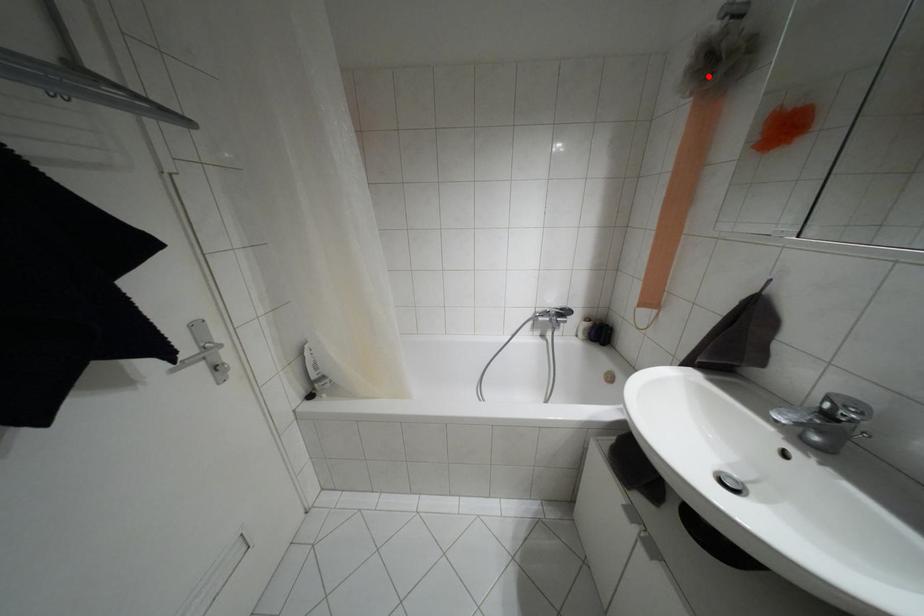
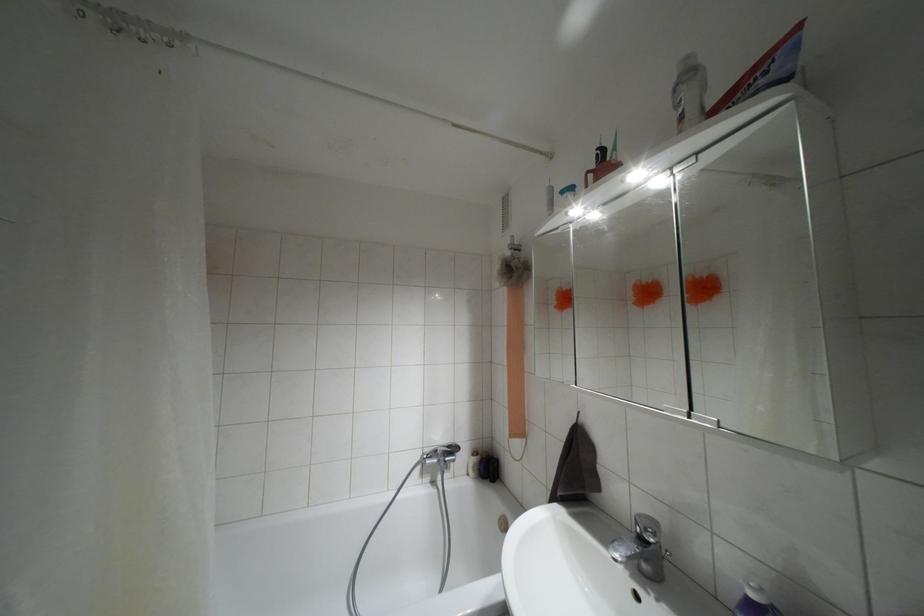
Question: I am providing you with two images of the same scene from different viewpoints. A red point is marked on the first image. At the location where the point appears in image 1, is it still visible in image 2?

Choices:
 (A) Yes
 (B) No

Answer: (A)